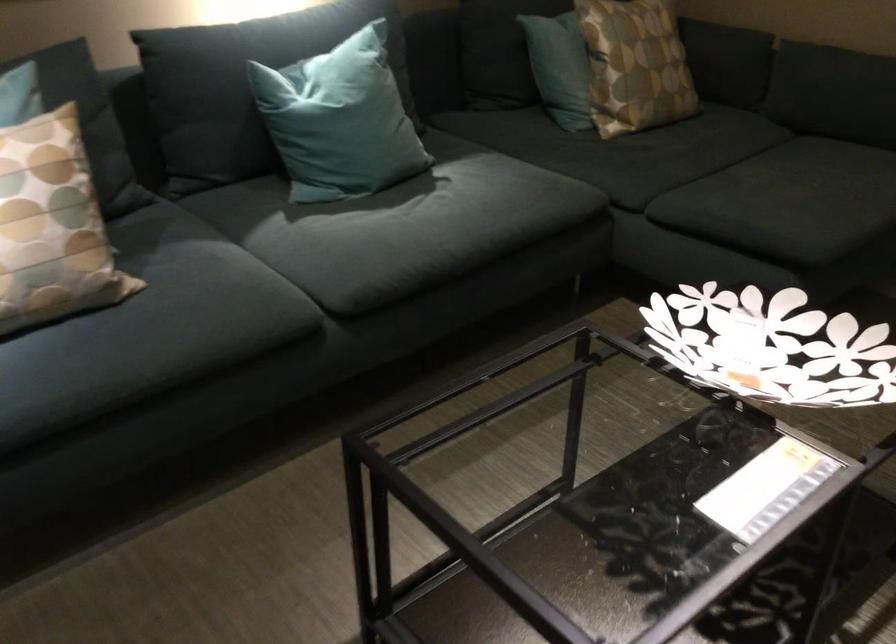
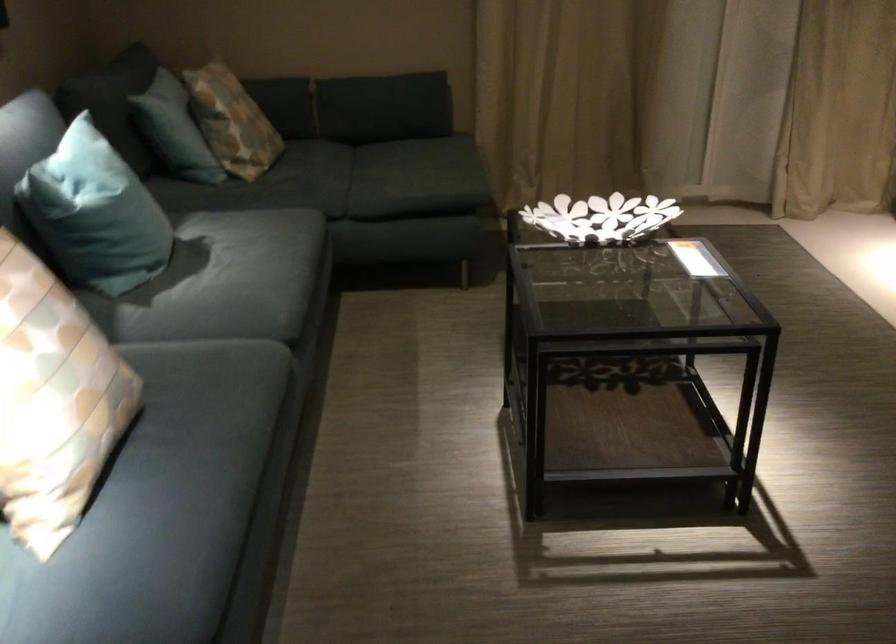
Where in the second image is the point corresponding to point (810, 350) from the first image?

(600, 218)